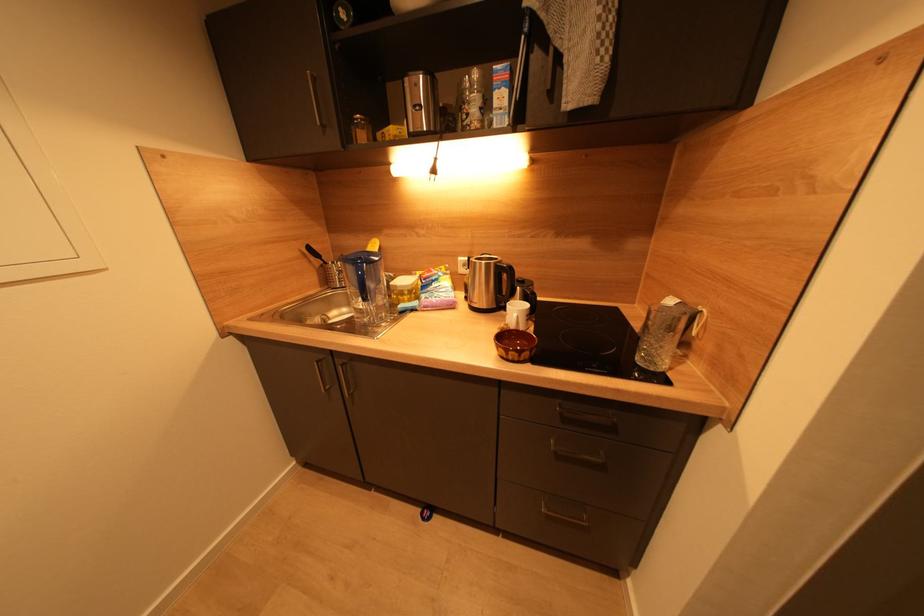
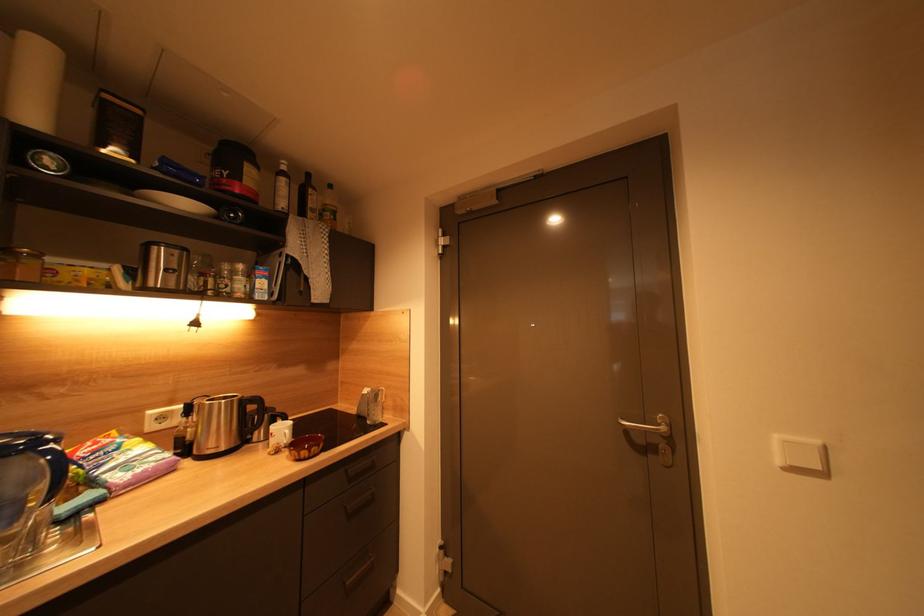
Question: The camera is either moving clockwise (left) or counter-clockwise (right) around the object. The first image is from the beginning of the video and the second image is from the end. Is the camera moving left or right when shooting the video?

Choices:
 (A) Left
 (B) Right

Answer: (A)